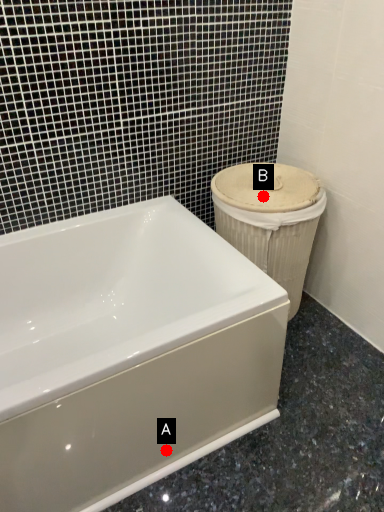
Question: Two points are circled on the image, labeled by A and B beside each circle. Which point is further to the camera?

Choices:
 (A) A is further
 (B) B is further

Answer: (B)